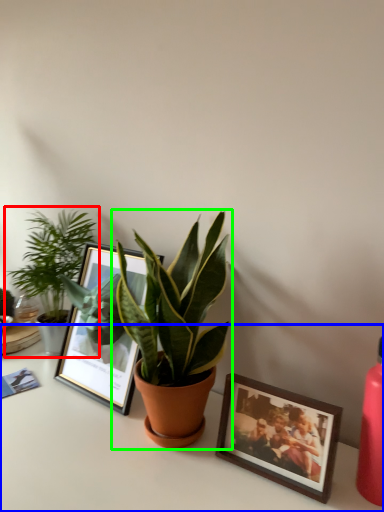
Question: Estimate the real-world distances between objects in this image. Which object is closer to houseplant (highlighted by a red box), table (highlighted by a blue box) or houseplant (highlighted by a green box)?

Choices:
 (A) table
 (B) houseplant

Answer: (B)